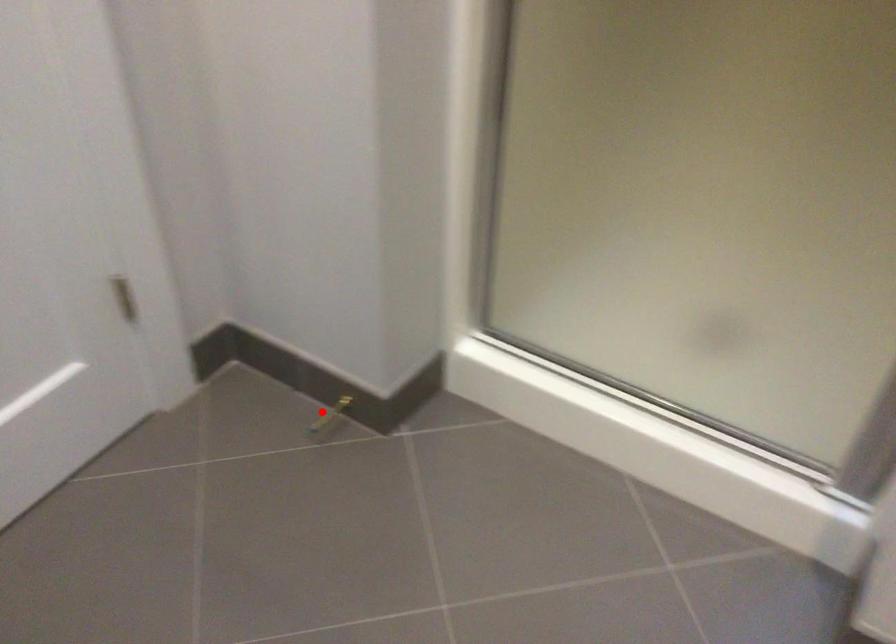
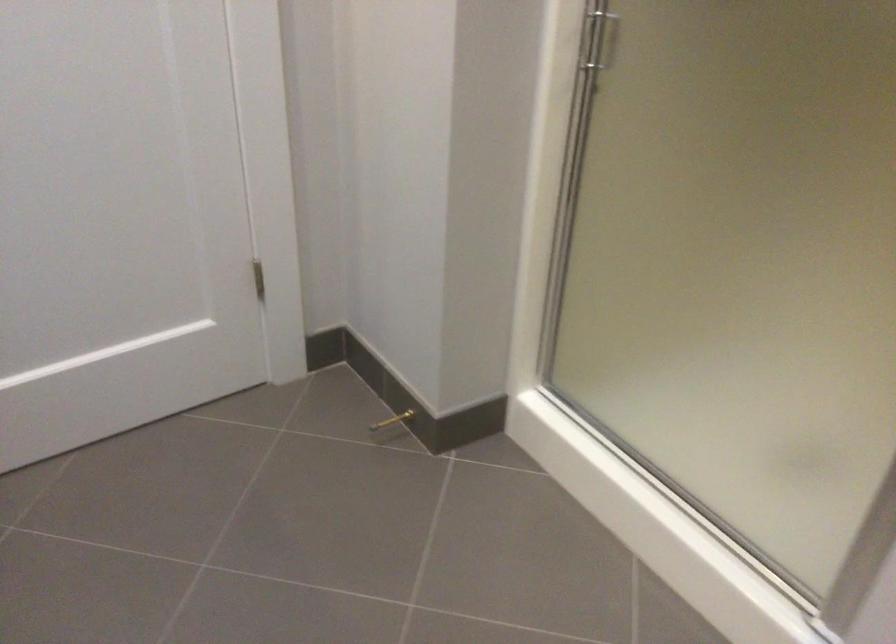
Find the pixel in the second image that matches the highlighted location in the first image.

(392, 420)